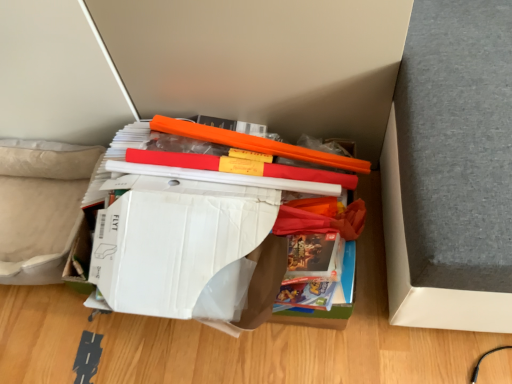
Question: Considering the relative sizes of white cardboard box at center, which ranks as the second paperback book in front-to-back order, and orange plastic ruler at center in the image provided, is white cardboard box at center, which ranks as the second paperback book in front-to-back order, shorter than orange plastic ruler at center?

Choices:
 (A) yes
 (B) no

Answer: (B)

Question: Considering the relative positions of white cardboard box at center, which ranks as the second paperback book in front-to-back order, and orange plastic ruler at center in the image provided, is white cardboard box at center, which ranks as the second paperback book in front-to-back order, behind orange plastic ruler at center?

Choices:
 (A) yes
 (B) no

Answer: (B)

Question: From the image's perspective, is white cardboard box at center, which is counted as the 1th paperback book, starting from the back, below orange plastic ruler at center?

Choices:
 (A) no
 (B) yes

Answer: (B)

Question: Can you confirm if white cardboard box at center, which is counted as the 1th paperback book, starting from the back, is taller than orange plastic ruler at center?

Choices:
 (A) yes
 (B) no

Answer: (A)

Question: From a real-world perspective, does white cardboard box at center, which is counted as the 1th paperback book, starting from the back, sit lower than orange plastic ruler at center?

Choices:
 (A) yes
 (B) no

Answer: (A)

Question: From the image's perspective, is orange plastic ruler at center positioned above or below white cardboard box at center, which is counted as the 1th paperback book, starting from the back?

Choices:
 (A) below
 (B) above

Answer: (B)

Question: Choose the correct answer: Is orange plastic ruler at center inside white cardboard box at center, which is counted as the 1th paperback book, starting from the back, or outside it?

Choices:
 (A) outside
 (B) inside

Answer: (A)

Question: Looking at their shapes, would you say orange plastic ruler at center is wider or thinner than white cardboard box at center, which is counted as the 1th paperback book, starting from the back?

Choices:
 (A) wide
 (B) thin

Answer: (B)

Question: Looking at the image, does orange plastic ruler at center seem bigger or smaller compared to white cardboard box at center, which ranks as the second paperback book in front-to-back order?

Choices:
 (A) small
 (B) big

Answer: (A)

Question: In the image, is white cardboard box at center, which ranks as the second paperback book in front-to-back order, positioned in front of or behind white cardboard box at center, positioned as the first paperback book in front-to-back order?

Choices:
 (A) behind
 (B) front

Answer: (A)

Question: Is point (143, 244) closer or farther from the camera than point (108, 286)?

Choices:
 (A) closer
 (B) farther

Answer: (B)

Question: Considering the relative positions of white cardboard box at center, which is counted as the 1th paperback book, starting from the back, and white cardboard box at center, positioned as the first paperback book in front-to-back order, in the image provided, is white cardboard box at center, which is counted as the 1th paperback book, starting from the back, to the left or to the right of white cardboard box at center, positioned as the first paperback book in front-to-back order,?

Choices:
 (A) left
 (B) right

Answer: (B)

Question: Do you think white cardboard box at center, which is counted as the 1th paperback book, starting from the back, is within white cardboard box at center, positioned as the first paperback book in front-to-back order, or outside of it?

Choices:
 (A) outside
 (B) inside

Answer: (A)

Question: In the image, is white cardboard box at center, positioned as the first paperback book in front-to-back order, on the left side or the right side of white cardboard box at center, which is counted as the 1th paperback book, starting from the back?

Choices:
 (A) right
 (B) left

Answer: (B)

Question: Is point (100, 286) closer or farther from the camera than point (265, 253)?

Choices:
 (A) closer
 (B) farther

Answer: (B)